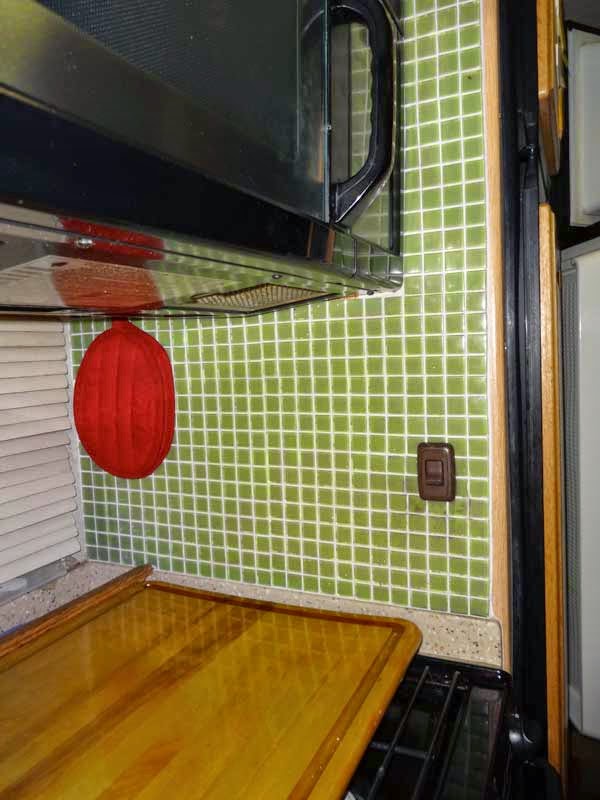
Find the location of a particular element. This screenshot has width=600, height=800. microwave handle is located at coordinates (381, 86).